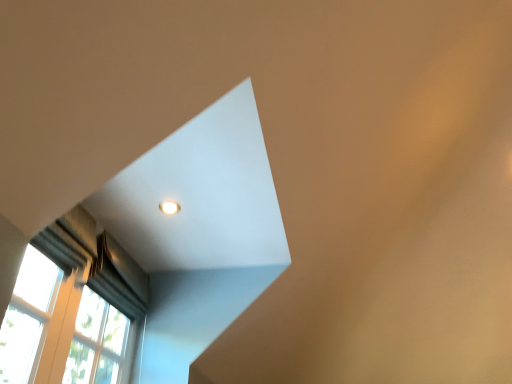
Question: Can we say white glossy light fixture at upper center lies outside dark gray textured curtain at left?

Choices:
 (A) no
 (B) yes

Answer: (B)

Question: Considering the relative sizes of white glossy light fixture at upper center and dark gray textured curtain at left in the image provided, is white glossy light fixture at upper center bigger than dark gray textured curtain at left?

Choices:
 (A) no
 (B) yes

Answer: (A)

Question: From a real-world perspective, is white glossy light fixture at upper center positioned under dark gray textured curtain at left based on gravity?

Choices:
 (A) no
 (B) yes

Answer: (A)

Question: Does white glossy light fixture at upper center have a smaller size compared to dark gray textured curtain at left?

Choices:
 (A) yes
 (B) no

Answer: (A)

Question: Can you confirm if white glossy light fixture at upper center is thinner than dark gray textured curtain at left?

Choices:
 (A) yes
 (B) no

Answer: (A)

Question: From the image's perspective, would you say white glossy light fixture at upper center is shown under dark gray textured curtain at left?

Choices:
 (A) no
 (B) yes

Answer: (A)

Question: Can you confirm if dark gray textured curtain at left is taller than white glossy light fixture at upper center?

Choices:
 (A) yes
 (B) no

Answer: (A)

Question: Does dark gray textured curtain at left have a smaller size compared to white glossy light fixture at upper center?

Choices:
 (A) no
 (B) yes

Answer: (A)

Question: From a real-world perspective, is dark gray textured curtain at left located beneath white glossy light fixture at upper center?

Choices:
 (A) yes
 (B) no

Answer: (A)

Question: Is dark gray textured curtain at left oriented away from white glossy light fixture at upper center?

Choices:
 (A) yes
 (B) no

Answer: (B)

Question: Is dark gray textured curtain at left placed right next to white glossy light fixture at upper center?

Choices:
 (A) yes
 (B) no

Answer: (B)

Question: Does dark gray textured curtain at left lie behind white glossy light fixture at upper center?

Choices:
 (A) no
 (B) yes

Answer: (A)

Question: Visually, is dark gray textured curtain at left positioned to the left or to the right of white glossy light fixture at upper center?

Choices:
 (A) right
 (B) left

Answer: (B)